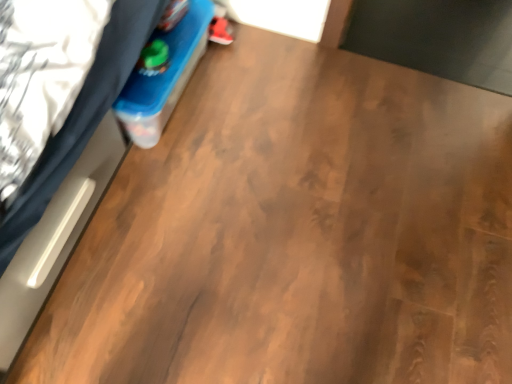
At what (x,y) coordinates should I click in order to perform the action: click on spots to the right of white matte bed at left. Please return your answer as a coordinate pair (x, y). This screenshot has width=512, height=384. Looking at the image, I should click on pos(190,248).